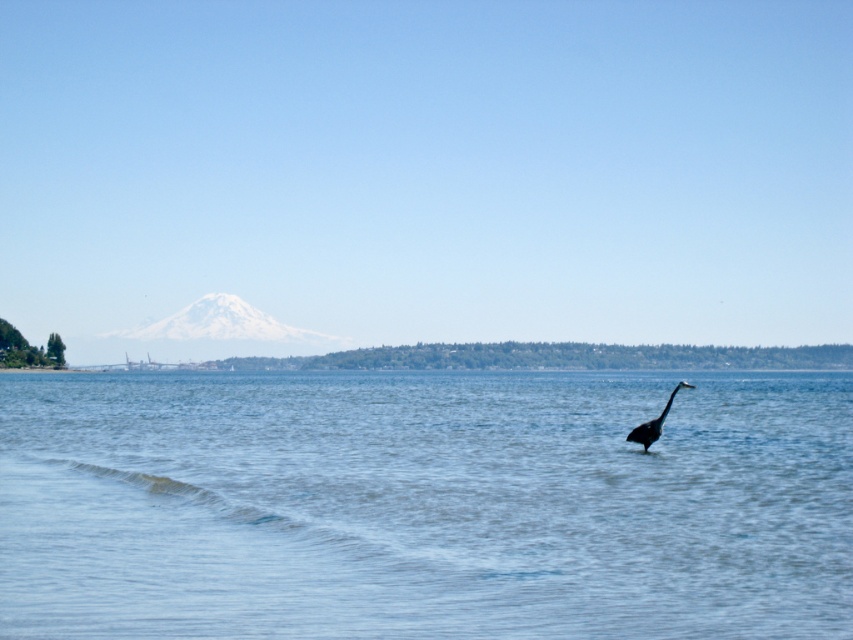
You are standing at the point marked by the coordinates point [424,506]. Based on the scene description, what would you most likely see around you?

The clear blue water at center is represented by point [424,506], so you would most likely see the calm body of water with gentle waves lapping at the shore around you.

You are standing at the shore in the coastal scene and want to determine which of the two points, point [427,378] or point [645,433], is closer to you. Based on the scene description, which point is nearer?

Point [427,378] is closer to you because it is further to the viewer than point [645,433].